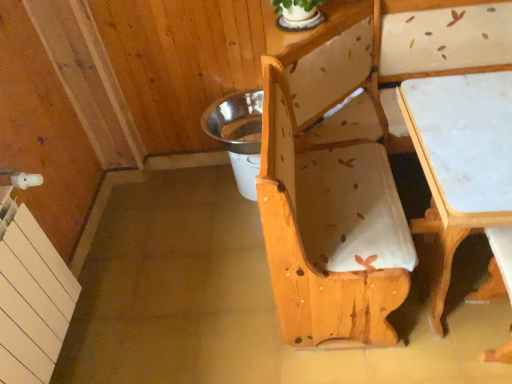
Identify the location of metallic silver potty at center. (238, 134).

Locate an element on the screen. natural wood bench at center is located at coordinates (331, 185).

Identify the location of white marble table at lower right. The image size is (512, 384). (460, 162).

Is white marble table at lower right not within natural wood bench at center?

No, white marble table at lower right is not entirely external to natural wood bench at center.

Is white marble table at lower right directly adjacent to natural wood bench at center?

No, white marble table at lower right is not in contact with natural wood bench at center.

Considering the relative sizes of white marble table at lower right and natural wood bench at center in the image provided, is white marble table at lower right shorter than natural wood bench at center?

Yes.

How much distance is there between white marble table at lower right and natural wood bench at center?

The distance of white marble table at lower right from natural wood bench at center is 13.61 inches.

The height and width of the screenshot is (384, 512). I want to click on table below the natural wood bench at center (from the image's perspective), so click(x=460, y=162).

Is natural wood bench at center positioned in front of white marble table at lower right?

Yes, natural wood bench at center is closer to the viewer.

From a real-world perspective, is natural wood bench at center positioned above or below white marble table at lower right?

natural wood bench at center is above white marble table at lower right.

Does point (279, 181) come closer to viewer compared to point (499, 202)?

No.

Is natural wood bench at center completely or partially inside metallic silver potty at center?

No.

Considering the relative sizes of metallic silver potty at center and natural wood bench at center in the image provided, is metallic silver potty at center wider than natural wood bench at center?

No, metallic silver potty at center is not wider than natural wood bench at center.

From the image's perspective, which is above, metallic silver potty at center or natural wood bench at center?

metallic silver potty at center appears higher in the image.

From a real-world perspective, between metallic silver potty at center and natural wood bench at center, who is vertically lower?

metallic silver potty at center is physically lower.

From a real-world perspective, which is physically below, metallic silver potty at center or white marble table at lower right?

metallic silver potty at center.

Between metallic silver potty at center and white marble table at lower right, which one is positioned in front?

white marble table at lower right.

Is metallic silver potty at center bigger or smaller than white marble table at lower right?

Clearly, metallic silver potty at center is smaller in size than white marble table at lower right.

Does natural wood bench at center appear on the right side of metallic silver potty at center?

Indeed, natural wood bench at center is positioned on the right side of metallic silver potty at center.

Is natural wood bench at center far from metallic silver potty at center?

No, natural wood bench at center is not far away from metallic silver potty at center.

From the picture: In the image, is natural wood bench at center positioned in front of or behind metallic silver potty at center?

natural wood bench at center is positioned closer to the viewer than metallic silver potty at center.

Is point (344, 255) closer or farther from the camera than point (242, 161)?

Point (344, 255) is closer to the camera than point (242, 161).

Does white marble table at lower right appear on the right side of metallic silver potty at center?

Yes.

Is white marble table at lower right taller or shorter than metallic silver potty at center?

white marble table at lower right is taller than metallic silver potty at center.

How far apart are white marble table at lower right and metallic silver potty at center?

They are 35.99 inches apart.

Which is less distant, (487,138) or (234,168)?

Answer: Point (487,138) is positioned closer to the camera compared to point (234,168).

This screenshot has width=512, height=384. Identify the location of chair above the white marble table at lower right (from a real-world perspective). (331, 185).

Identify the location of table below the natural wood bench at center (from the image's perspective). This screenshot has height=384, width=512. (460, 162).

Considering their positions, is white marble table at lower right positioned further to natural wood bench at center than metallic silver potty at center?

Based on the image, metallic silver potty at center appears to be further to natural wood bench at center.

Considering their positions, is natural wood bench at center positioned closer to white marble table at lower right than metallic silver potty at center?

Among the two, natural wood bench at center is located nearer to white marble table at lower right.

Consider the image. Based on their spatial positions, is metallic silver potty at center or white marble table at lower right closer to natural wood bench at center?

white marble table at lower right.

From the image, which object appears to be farther from white marble table at lower right, metallic silver potty at center or natural wood bench at center?

metallic silver potty at center lies further to white marble table at lower right than the other object.

From the image, which object appears to be nearer to metallic silver potty at center, natural wood bench at center or white marble table at lower right?

natural wood bench at center is positioned closer to the anchor metallic silver potty at center.

Estimate the real-world distances between objects in this image. Which object is closer to metallic silver potty at center, white marble table at lower right or natural wood bench at center?

natural wood bench at center is positioned closer to the anchor metallic silver potty at center.

Locate an element on the screen. Image resolution: width=512 pixels, height=384 pixels. table between natural wood bench at center and metallic silver potty at center from front to back is located at coordinates (460, 162).